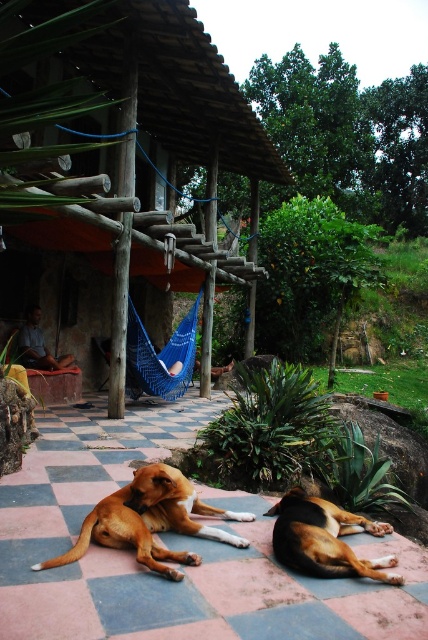
Question: Which point is farther from the camera taking this photo?

Choices:
 (A) pyautogui.click(x=151, y=508)
 (B) pyautogui.click(x=213, y=204)

Answer: (B)

Question: Based on their relative distances, which object is nearer to the wooden hut at center?

Choices:
 (A) blue knitted hammock at center
 (B) wooden chair at center

Answer: (A)

Question: Which point is closer to the camera taking this photo?

Choices:
 (A) (187, 353)
 (B) (253, 147)
 (C) (305, 556)
 (D) (38, 317)

Answer: (C)

Question: Does brown furry dog at lower center appear on the left side of blue knitted hammock at center?

Choices:
 (A) yes
 (B) no

Answer: (B)

Question: Observing the image, what is the correct spatial positioning of wooden hut at center in reference to blue knitted hammock at center?

Choices:
 (A) below
 (B) above

Answer: (B)

Question: Is wooden hut at center further to camera compared to brown furry dog at lower center?

Choices:
 (A) yes
 (B) no

Answer: (B)